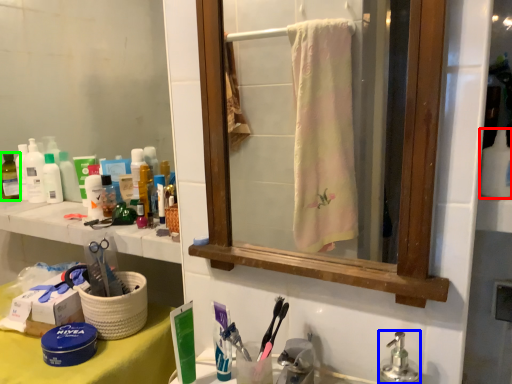
Question: Considering the real-world distances, which object is closest to cleaning product (highlighted by a red box)? soap dispenser (highlighted by a blue box) or toiletry (highlighted by a green box).

Choices:
 (A) soap dispenser
 (B) toiletry

Answer: (A)